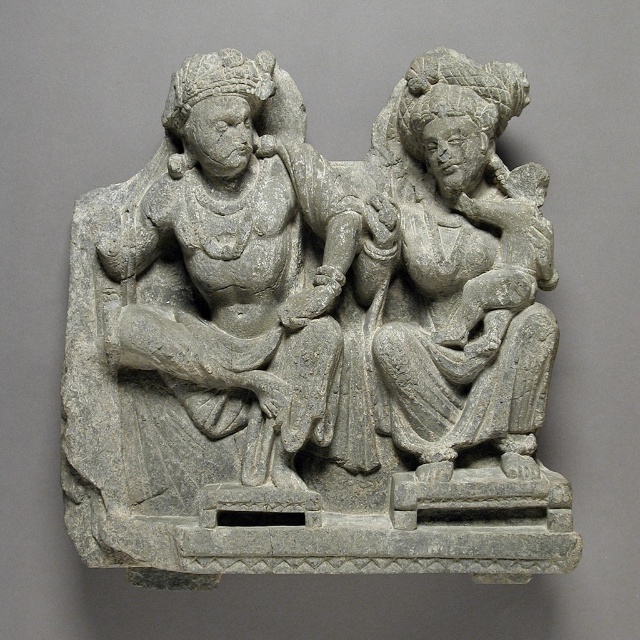
Who is more distant from viewer, [195,385] or [515,104]?

The point [515,104] is more distant.

In the scene shown: Which is more to the left, gray stone sculpture at center or gray stone statue at right?

Positioned to the left is gray stone sculpture at center.

Between point (502, 304) and point (445, 227), which one is positioned in front?

Positioned in front is point (502, 304).

Locate an element on the screen. gray stone sculpture at center is located at coordinates (314, 339).

Is gray stone statue at left taller than gray stone statue at right?

Yes, gray stone statue at left is taller than gray stone statue at right.

Find the location of `gray stone statue at left`. gray stone statue at left is located at coordinates (241, 264).

Find the location of a particular element. gray stone statue at left is located at coordinates (241, 264).

Does gray stone sculpture at center have a lesser height compared to gray stone statue at left?

In fact, gray stone sculpture at center may be taller than gray stone statue at left.

Can you confirm if gray stone sculpture at center is positioned below gray stone statue at left?

Yes.

What do you see at coordinates (314, 339) in the screenshot? I see `gray stone sculpture at center` at bounding box center [314, 339].

Find the location of `gray stone sculpture at center`. gray stone sculpture at center is located at coordinates (314, 339).